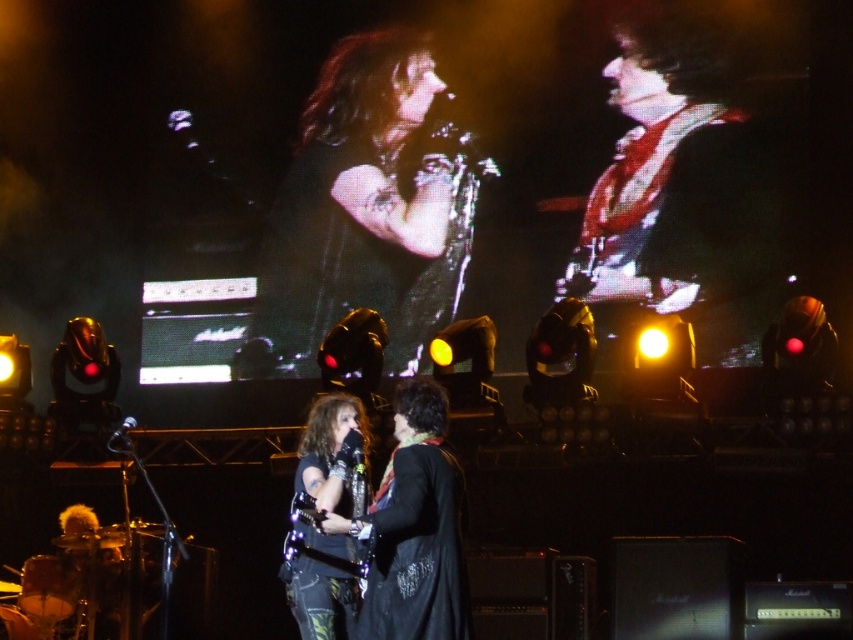
Question: Which point is farther to the camera?

Choices:
 (A) (428, 294)
 (B) (634, 93)

Answer: (A)

Question: Is the position of shiny black leather jacket at center less distant than that of shiny red guitar at upper right?

Choices:
 (A) yes
 (B) no

Answer: (B)

Question: From the image, what is the correct spatial relationship of shiny black leather jacket at center in relation to shiny red guitar at upper right?

Choices:
 (A) below
 (B) above

Answer: (B)

Question: Can you confirm if shiny black leather jacket at center is bigger than shiny red guitar at upper right?

Choices:
 (A) no
 (B) yes

Answer: (A)